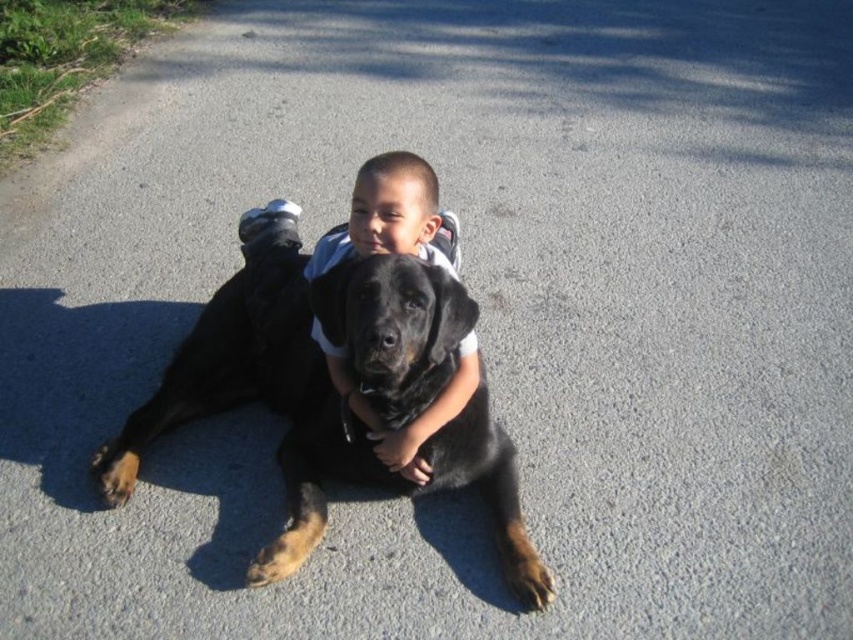
What is the 2D coordinate of the black fur dog at center?

The black fur dog at center is located at the 2D coordinate point of (303,369).